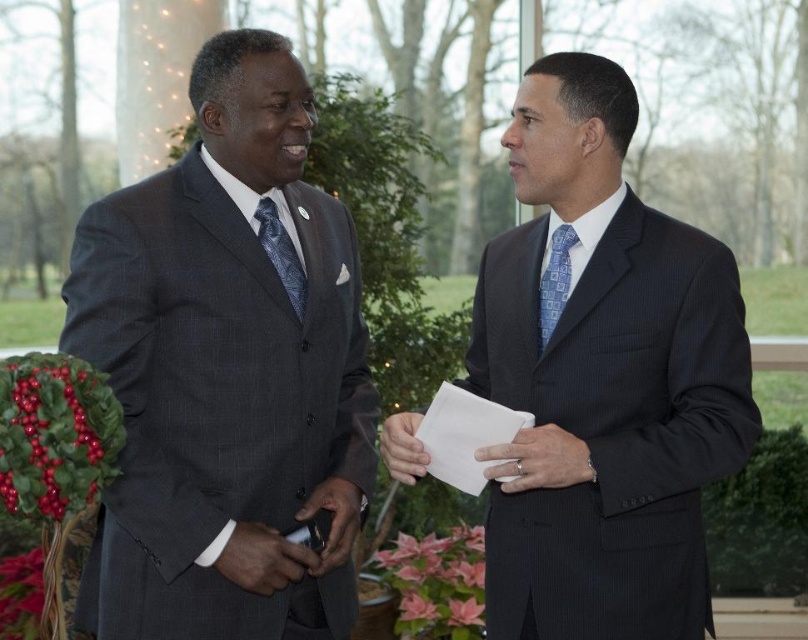
Question: Among these points, which one is farthest from the camera?

Choices:
 (A) (417, 461)
 (B) (562, 250)
 (C) (234, 550)
 (D) (175, 257)

Answer: (B)

Question: Which object is positioned closest to the dark pinstripe suit at center?

Choices:
 (A) blue textured tie at right
 (B) blue textured tie at left
 (C) matte black phone at center
 (D) matte gray suit at center

Answer: (A)

Question: Does matte black suit at center come behind matte black phone at center?

Choices:
 (A) no
 (B) yes

Answer: (A)

Question: Is dark pinstripe suit at center thinner than blue textured tie at right?

Choices:
 (A) no
 (B) yes

Answer: (A)

Question: Which object appears farthest from the camera in this image?

Choices:
 (A) white paper at center
 (B) matte black suit at center

Answer: (A)

Question: Can you confirm if dark pinstripe suit at center is positioned above matte black phone at center?

Choices:
 (A) no
 (B) yes

Answer: (B)